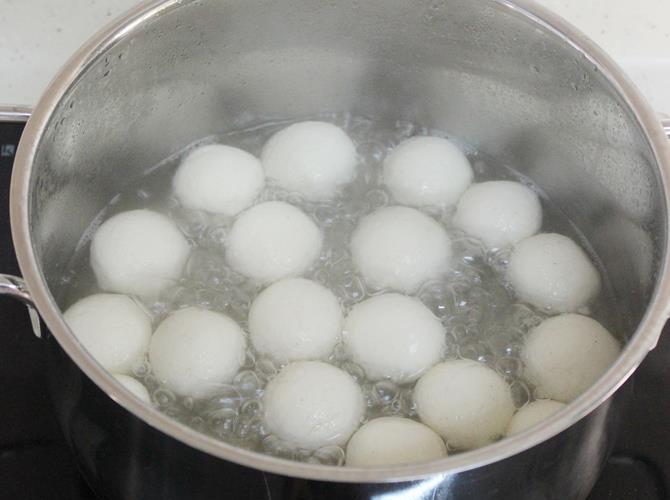
Find the location of `white wall`. white wall is located at coordinates coord(31,35).